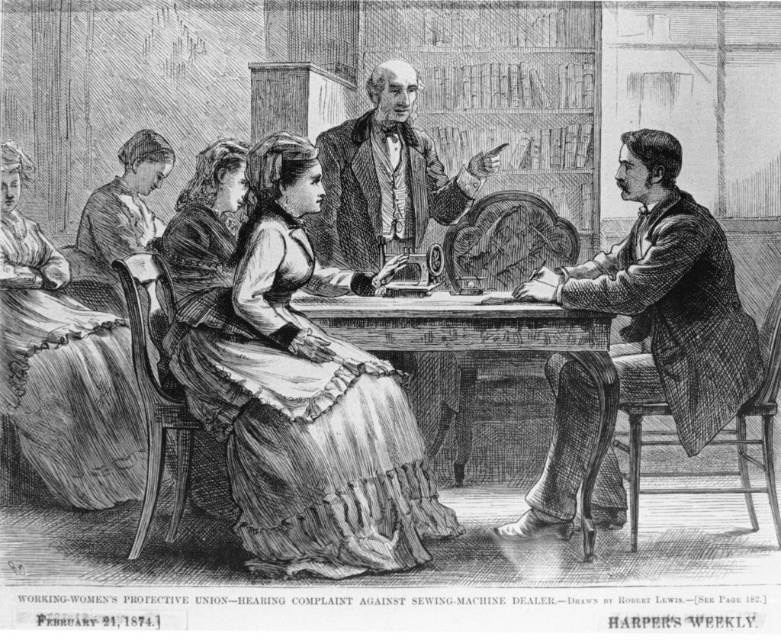
Question: Can you confirm if smooth brown suit at right is bigger than smooth brown coat at center?

Choices:
 (A) no
 (B) yes

Answer: (B)

Question: Which point is farther from the camera taking this photo?

Choices:
 (A) (648, 260)
 (B) (416, 243)

Answer: (B)

Question: Which of the following is the closest to the observer?

Choices:
 (A) (118, 330)
 (B) (352, 134)

Answer: (B)

Question: Is matte white dress at left positioned in front of wooden table at center?

Choices:
 (A) yes
 (B) no

Answer: (B)

Question: Which point is farther to the camera?

Choices:
 (A) wooden table at center
 (B) smooth gray suit at center
 (C) matte brown dress at center
 (D) matte white dress at left

Answer: (B)

Question: Does matte white dress at left have a greater width compared to smooth brown coat at center?

Choices:
 (A) yes
 (B) no

Answer: (A)